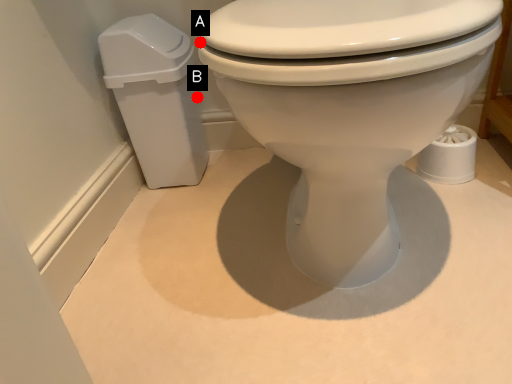
Question: Two points are circled on the image, labeled by A and B beside each circle. Among these points, which one is nearest to the camera?

Choices:
 (A) A is closer
 (B) B is closer

Answer: (B)